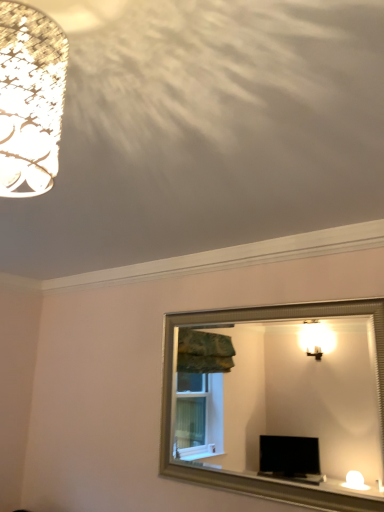
Question: Is matte white lampshade at upper left bigger than silver/metallic mirror at center?

Choices:
 (A) no
 (B) yes

Answer: (A)

Question: Considering the relative sizes of matte white lampshade at upper left and silver/metallic mirror at center in the image provided, is matte white lampshade at upper left smaller than silver/metallic mirror at center?

Choices:
 (A) no
 (B) yes

Answer: (B)

Question: Is the depth of matte white lampshade at upper left less than that of silver/metallic mirror at center?

Choices:
 (A) yes
 (B) no

Answer: (A)

Question: Considering the relative sizes of matte white lampshade at upper left and silver/metallic mirror at center in the image provided, is matte white lampshade at upper left taller than silver/metallic mirror at center?

Choices:
 (A) no
 (B) yes

Answer: (A)

Question: Can silver/metallic mirror at center be found inside matte white lampshade at upper left?

Choices:
 (A) yes
 (B) no

Answer: (B)

Question: Is matte white lampshade at upper left far away from silver/metallic mirror at center?

Choices:
 (A) yes
 (B) no

Answer: (A)

Question: Is silver/metallic mirror at center not inside matte white lampshade at upper left?

Choices:
 (A) yes
 (B) no

Answer: (A)

Question: Considering the relative sizes of silver/metallic mirror at center and matte white lampshade at upper left in the image provided, is silver/metallic mirror at center smaller than matte white lampshade at upper left?

Choices:
 (A) no
 (B) yes

Answer: (A)

Question: Considering the relative sizes of silver/metallic mirror at center and matte white lampshade at upper left in the image provided, is silver/metallic mirror at center shorter than matte white lampshade at upper left?

Choices:
 (A) yes
 (B) no

Answer: (B)

Question: Does silver/metallic mirror at center have a greater height compared to matte white lampshade at upper left?

Choices:
 (A) no
 (B) yes

Answer: (B)

Question: Is silver/metallic mirror at center next to matte white lampshade at upper left and touching it?

Choices:
 (A) yes
 (B) no

Answer: (B)

Question: Considering the relative sizes of silver/metallic mirror at center and matte white lampshade at upper left in the image provided, is silver/metallic mirror at center bigger than matte white lampshade at upper left?

Choices:
 (A) yes
 (B) no

Answer: (A)

Question: Considering the positions of matte white lampshade at upper left and silver/metallic mirror at center in the image, is matte white lampshade at upper left wider or thinner than silver/metallic mirror at center?

Choices:
 (A) wide
 (B) thin

Answer: (A)